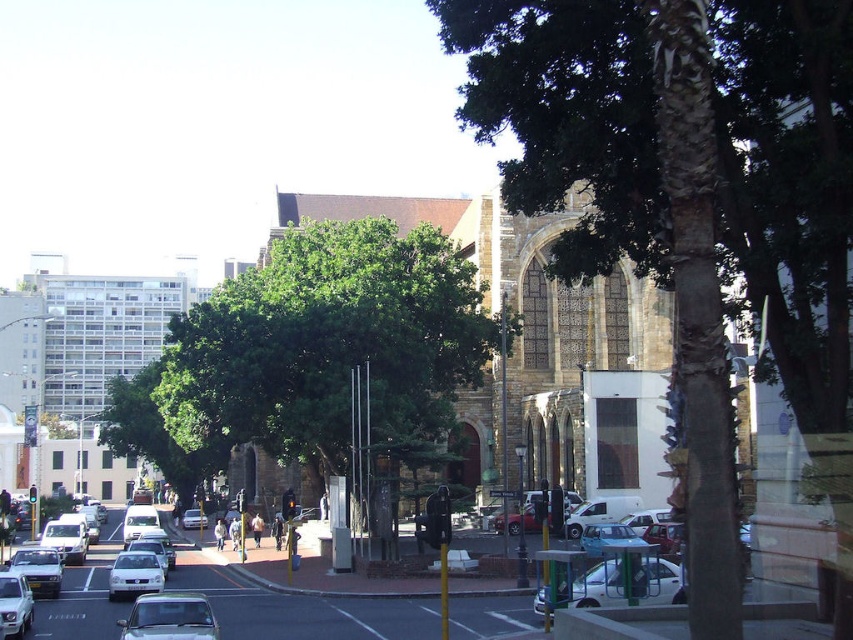
Question: Which of the following is the farthest from the observer?

Choices:
 (A) (132, 556)
 (B) (57, 532)

Answer: (B)

Question: Which of the following is the closest to the observer?

Choices:
 (A) (170, 593)
 (B) (410, 339)

Answer: (A)

Question: Is brown textured bark at center further to the viewer compared to white matte car at lower right?

Choices:
 (A) no
 (B) yes

Answer: (A)

Question: Considering the relative positions of matte silver sedan at lower left and white matte car at center in the image provided, where is matte silver sedan at lower left located with respect to white matte car at center?

Choices:
 (A) below
 (B) above

Answer: (B)

Question: Can you confirm if green leafy tree at center is positioned below white matte car at lower right?

Choices:
 (A) yes
 (B) no

Answer: (B)

Question: Which of the following is the farthest from the observer?

Choices:
 (A) (3, 576)
 (B) (154, 636)

Answer: (A)